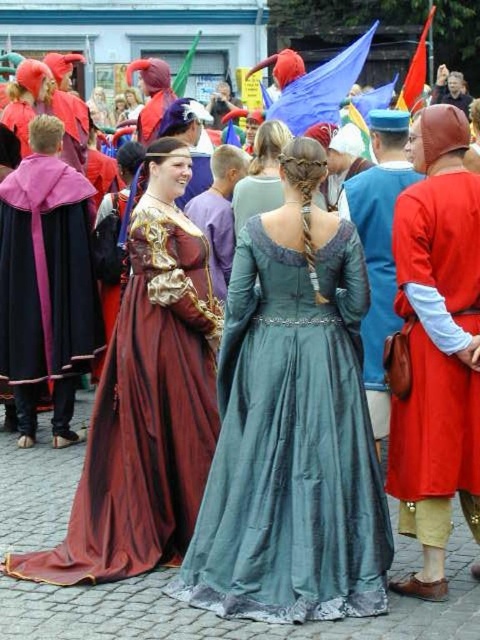
You are a photographer at the event and want to take a photo of both the matte burgundy gown at center and the matte red tunic at right. Which one should you focus on first to ensure it appears sharp in the photo?

You should focus on the matte burgundy gown at center first because it is closer to you than the matte red tunic at right, ensuring it will be sharp while the background may blur slightly.

You are a photographer at the historical event and want to capture both the silky teal gown at center and the matte red tunic at right in a single wide shot. Your camera has a maximum focus range of 3 meters. Will you be able to include both subjects in focus without moving closer?

The distance between the silky teal gown at center and the matte red tunic at right is 3.08 meters. Since the camera can only focus up to 3 meters, the subjects are slightly beyond the focus range. You might need to adjust your position or use a different lens to ensure both are in focus.